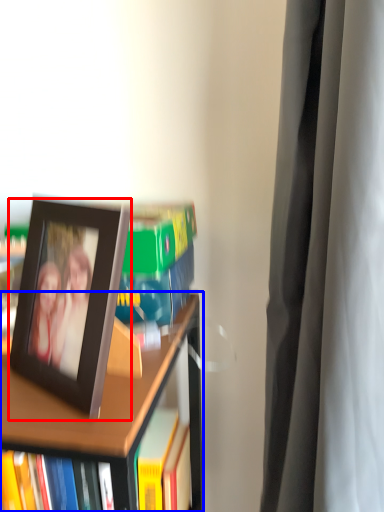
Question: Which object appears farthest to the camera in this image, picture frame (highlighted by a red box) or bookcase (highlighted by a blue box)?

Choices:
 (A) picture frame
 (B) bookcase

Answer: (B)